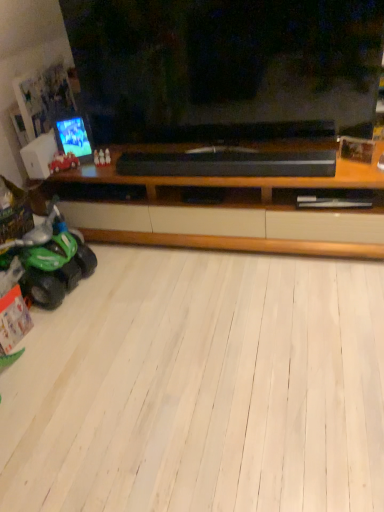
Find the location of a particular element. vacant region to the right of green plastic toy car at lower left, which appears as the 2th land vehicle when viewed from the top is located at coordinates (111, 279).